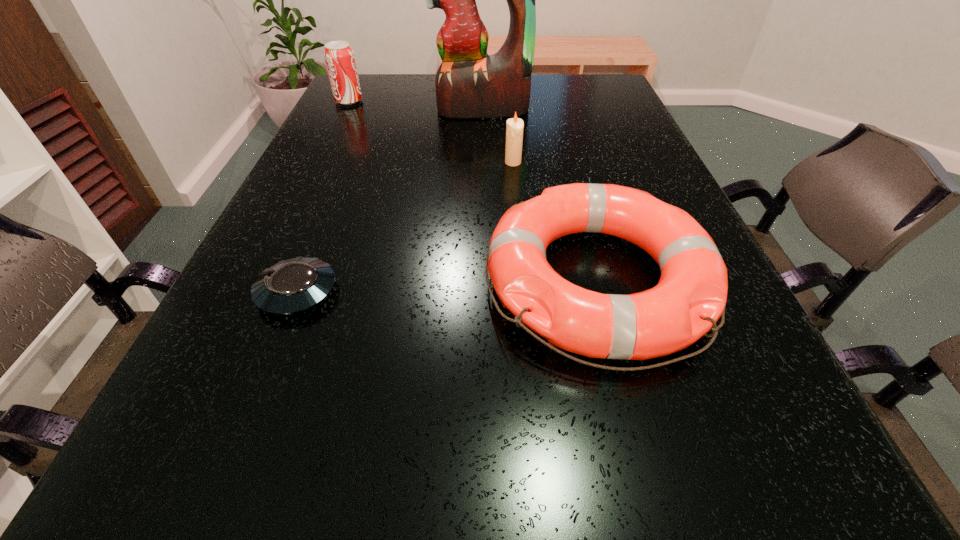
You are a GUI agent. You are given a task and a screenshot of the screen. Output one action in this format:
    pyautogui.click(x=<x>, y=<y>)
    Task: Click on the free space that satisfies the following two spatial constraints: 1. on the front side of the candle; 2. on the right side of the fourth tallest object
    The image size is (960, 540).
    Given the screenshot: What is the action you would take?
    pyautogui.click(x=525, y=280)